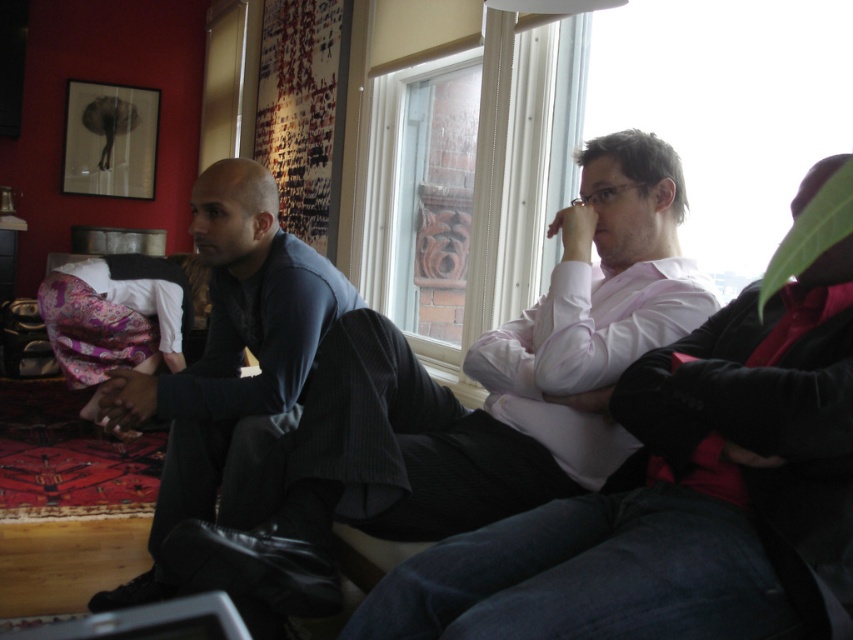
Is dark blue sweater at center to the left of dark blue shirt at left from the viewer's perspective?

In fact, dark blue sweater at center is to the right of dark blue shirt at left.

Can you confirm if dark blue sweater at center is smaller than dark blue shirt at left?

Yes.

Is point (622, 449) farther from camera compared to point (312, 292)?

No, (622, 449) is closer to viewer.

At what (x,y) coordinates should I click in order to perform the action: click on dark blue sweater at center. Please return your answer as a coordinate pair (x, y). Looking at the image, I should click on (474, 410).

Is dark blue sweater at center closer to camera compared to clear glass window at center?

Yes.

You are a GUI agent. You are given a task and a screenshot of the screen. Output one action in this format:
    pyautogui.click(x=<x>, y=<y>)
    Task: Click on the dark blue sweater at center
    The height and width of the screenshot is (640, 853).
    Given the screenshot: What is the action you would take?
    pyautogui.click(x=474, y=410)

You are a GUI agent. You are given a task and a screenshot of the screen. Output one action in this format:
    pyautogui.click(x=<x>, y=<y>)
    Task: Click on the dark blue sweater at center
    Image resolution: width=853 pixels, height=640 pixels.
    Given the screenshot: What is the action you would take?
    pyautogui.click(x=474, y=410)

Between dark blue shirt at left and clear glass window at center, which one appears on the right side from the viewer's perspective?

clear glass window at center

Can you confirm if dark blue shirt at left is shorter than clear glass window at center?

Correct, dark blue shirt at left is not as tall as clear glass window at center.

Which is behind, point (317, 346) or point (498, 109)?

The point (498, 109) is behind.

Where is `dark blue shirt at left`? The image size is (853, 640). dark blue shirt at left is located at coordinates (231, 368).